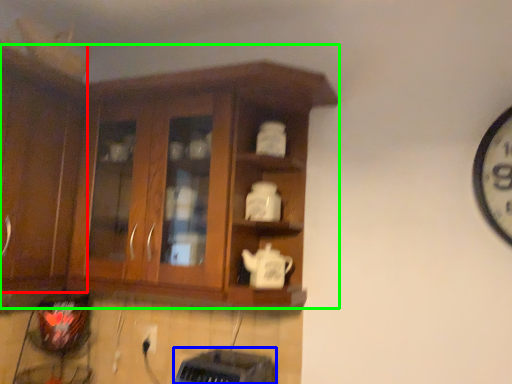
Question: Based on their relative distances, which object is nearer to cabinetry (highlighted by a red box)? Choose from appliance (highlighted by a blue box) and cabinetry (highlighted by a green box).

Choices:
 (A) appliance
 (B) cabinetry

Answer: (B)